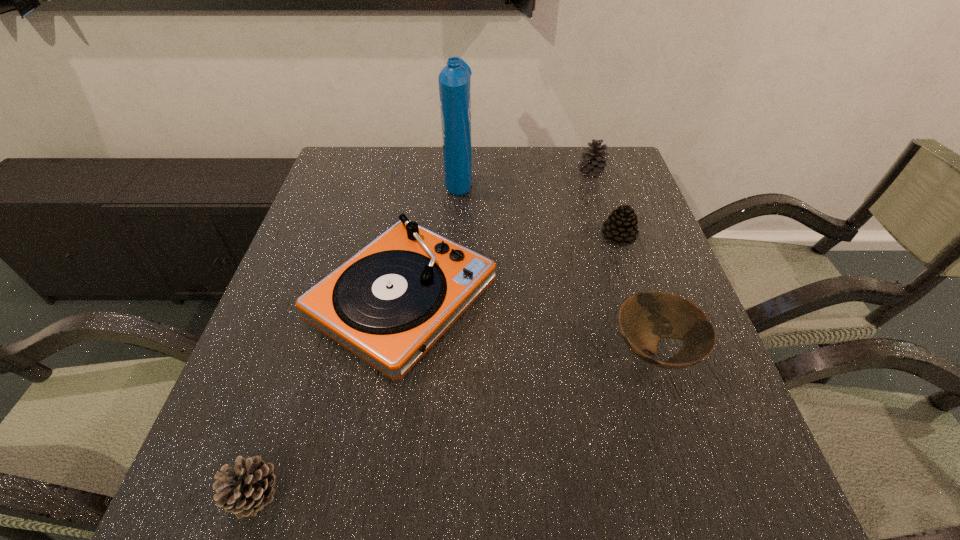
This screenshot has width=960, height=540. Find the location of `shampoo`. shampoo is located at coordinates (454, 80).

The image size is (960, 540). I want to click on the farthest pinecone, so tap(593, 163).

Locate an element on the screen. The image size is (960, 540). the second farthest pinecone is located at coordinates (621, 227).

At what (x,y) coordinates should I click in order to perform the action: click on record player. Please return your answer as a coordinate pair (x, y). The height and width of the screenshot is (540, 960). Looking at the image, I should click on (388, 304).

At what (x,y) coordinates should I click in order to perform the action: click on bowl. Please return your answer as a coordinate pair (x, y). Looking at the image, I should click on (644, 318).

Identify the location of the leftmost pinecone. The width and height of the screenshot is (960, 540). (249, 487).

Where is `the nearest object`? This screenshot has height=540, width=960. the nearest object is located at coordinates (249, 487).

You are a GUI agent. You are given a task and a screenshot of the screen. Output one action in this format:
    pyautogui.click(x=<x>, y=<y>)
    Task: Click on the vacant space located on the left of the shampoo
    This screenshot has width=960, height=540.
    Given the screenshot: What is the action you would take?
    pyautogui.click(x=386, y=177)

Find the location of a particular element. vacant space located 0.150m on the front of the farthest pinecone is located at coordinates (603, 214).

Identify the location of free space located at the narrow end of the second farthest pinecone. tap(640, 305).